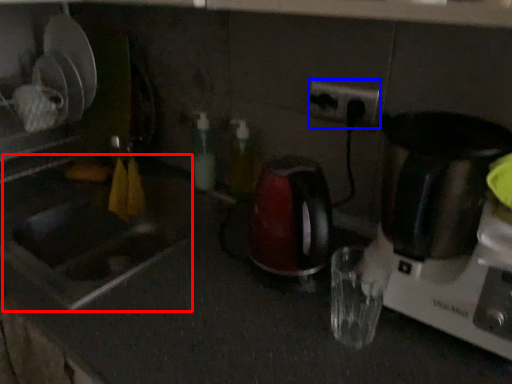
Question: Which object appears closest to the camera in this image, sink (highlighted by a red box) or electric outlet (highlighted by a blue box)?

Choices:
 (A) sink
 (B) electric outlet

Answer: (A)